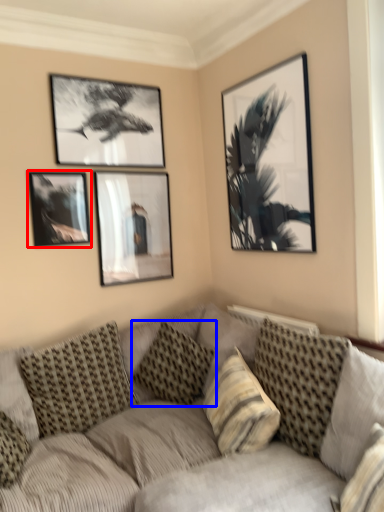
Question: Among these objects, which one is nearest to the camera, picture frame (highlighted by a red box) or pillow (highlighted by a blue box)?

Choices:
 (A) picture frame
 (B) pillow

Answer: (B)